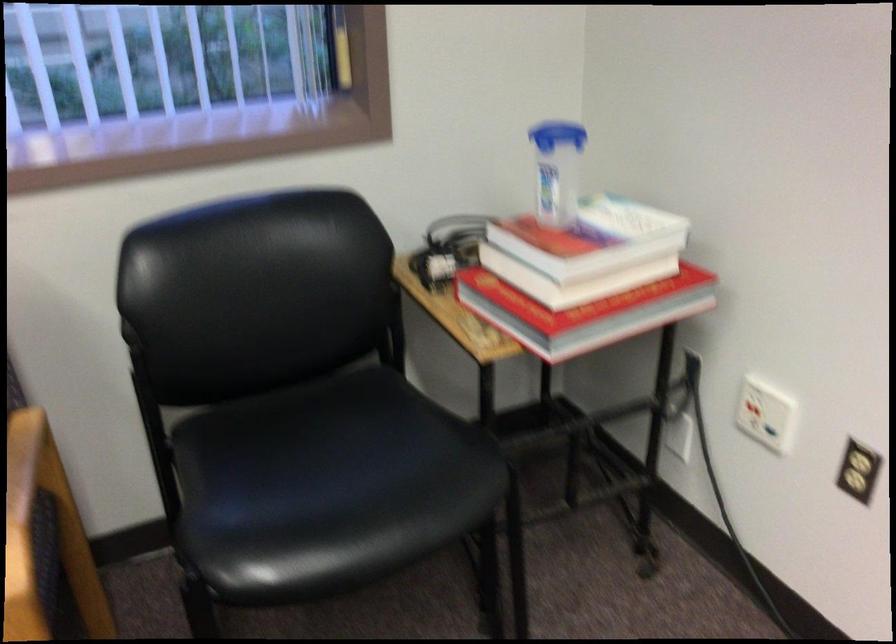
Find where to sit the chair sitting surface. Please return your answer as a coordinate pair (x, y).

(306, 469)